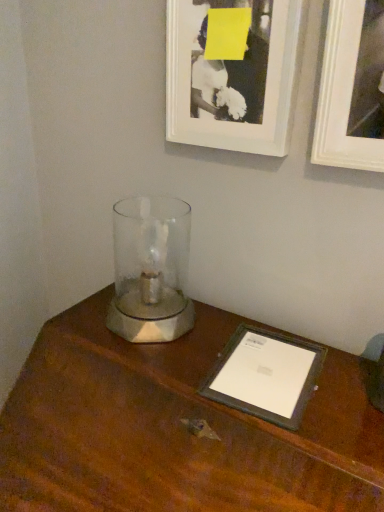
Question: From a real-world perspective, does white matte picture frame at upper right, acting as the 2th picture frame starting from the left, sit lower than black matte picture frame at upper center, placed as the 2th picture frame when sorted from right to left?

Choices:
 (A) yes
 (B) no

Answer: (B)

Question: Is white matte picture frame at upper right, acting as the 2th picture frame starting from the left, looking in the opposite direction of black matte picture frame at upper center, the 1th picture frame viewed from the left?

Choices:
 (A) no
 (B) yes

Answer: (A)

Question: Does white matte picture frame at upper right, acting as the 2th picture frame starting from the left, have a lesser height compared to black matte picture frame at upper center, placed as the 2th picture frame when sorted from right to left?

Choices:
 (A) yes
 (B) no

Answer: (B)

Question: Would you consider white matte picture frame at upper right, the 1th picture frame in the right-to-left sequence, to be distant from black matte picture frame at upper center, the 1th picture frame viewed from the left?

Choices:
 (A) no
 (B) yes

Answer: (A)

Question: Is white matte picture frame at upper right, the 1th picture frame in the right-to-left sequence, positioned behind black matte picture frame at upper center, placed as the 2th picture frame when sorted from right to left?

Choices:
 (A) no
 (B) yes

Answer: (A)

Question: Can you confirm if white matte picture frame at upper right, the 1th picture frame in the right-to-left sequence, is smaller than black matte picture frame at upper center, placed as the 2th picture frame when sorted from right to left?

Choices:
 (A) yes
 (B) no

Answer: (B)

Question: Can you confirm if black matte picture frame at upper center, the 1th picture frame viewed from the left, is bigger than white matte picture frame at upper right, acting as the 2th picture frame starting from the left?

Choices:
 (A) no
 (B) yes

Answer: (A)

Question: Considering the relative sizes of black matte picture frame at upper center, placed as the 2th picture frame when sorted from right to left, and white matte picture frame at upper right, acting as the 2th picture frame starting from the left, in the image provided, is black matte picture frame at upper center, placed as the 2th picture frame when sorted from right to left, wider than white matte picture frame at upper right, acting as the 2th picture frame starting from the left,?

Choices:
 (A) yes
 (B) no

Answer: (B)

Question: Considering the relative positions of black matte picture frame at upper center, placed as the 2th picture frame when sorted from right to left, and white matte picture frame at upper right, the 1th picture frame in the right-to-left sequence, in the image provided, is black matte picture frame at upper center, placed as the 2th picture frame when sorted from right to left, to the left of white matte picture frame at upper right, the 1th picture frame in the right-to-left sequence, from the viewer's perspective?

Choices:
 (A) yes
 (B) no

Answer: (A)

Question: Does black matte picture frame at upper center, placed as the 2th picture frame when sorted from right to left, appear on the right side of white matte picture frame at upper right, the 1th picture frame in the right-to-left sequence?

Choices:
 (A) no
 (B) yes

Answer: (A)

Question: From a real-world perspective, is black matte picture frame at upper center, placed as the 2th picture frame when sorted from right to left, physically above white matte picture frame at upper right, the 1th picture frame in the right-to-left sequence?

Choices:
 (A) no
 (B) yes

Answer: (A)

Question: Are black matte picture frame at upper center, the 1th picture frame viewed from the left, and white matte picture frame at upper right, the 1th picture frame in the right-to-left sequence, making contact?

Choices:
 (A) yes
 (B) no

Answer: (B)

Question: Is brown wood table at center at the back of white matte picture frame at upper right, the 1th picture frame in the right-to-left sequence?

Choices:
 (A) no
 (B) yes

Answer: (A)